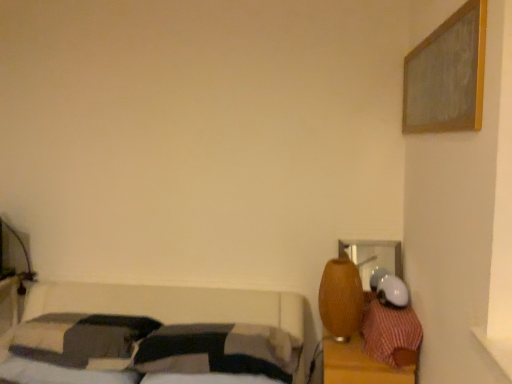
How much space does dark gray fabric pillow at lower left, the 1th pillow positioned from the left, occupy vertically?

6.39 inches.

Describe the element at coordinates (390, 333) in the screenshot. This screenshot has width=512, height=384. I see `red plaid pillow at right, marked as the 3th pillow in a left-to-right arrangement` at that location.

The width and height of the screenshot is (512, 384). What do you see at coordinates (359, 365) in the screenshot?
I see `wooden dresser at right` at bounding box center [359, 365].

You are a GUI agent. You are given a task and a screenshot of the screen. Output one action in this format:
    pyautogui.click(x=<x>, y=<y>)
    Task: Click on the braided wood table lamp at right
    This screenshot has height=384, width=512.
    Given the screenshot: What is the action you would take?
    pyautogui.click(x=341, y=299)

From the image's perspective, is soft cotton pillow at center, marked as the 2th pillow in a left-to-right arrangement, over braided wood table lamp at right?

Actually, soft cotton pillow at center, marked as the 2th pillow in a left-to-right arrangement, appears below braided wood table lamp at right in the image.

Looking at the image, does soft cotton pillow at center, marked as the 2th pillow in a left-to-right arrangement, seem bigger or smaller compared to braided wood table lamp at right?

Clearly, soft cotton pillow at center, marked as the 2th pillow in a left-to-right arrangement, is larger in size than braided wood table lamp at right.

Identify the location of the 3rd pillow located beneath the braided wood table lamp at right (from a real-world perspective). (220, 351).

From a real-world perspective, is braided wood table lamp at right positioned over red plaid pillow at right, marked as the 3th pillow in a left-to-right arrangement, based on gravity?

Yes.

Is point (352, 312) positioned after point (383, 361)?

That is True.

Is the surface of braided wood table lamp at right in direct contact with red plaid pillow at right, marked as the 3th pillow in a left-to-right arrangement?

No, braided wood table lamp at right is not touching red plaid pillow at right, marked as the 3th pillow in a left-to-right arrangement.

Considering the sizes of soft cotton pillow at center, positioned as the second pillow in right-to-left order, and wooden dresser at right in the image, is soft cotton pillow at center, positioned as the second pillow in right-to-left order, bigger or smaller than wooden dresser at right?

soft cotton pillow at center, positioned as the second pillow in right-to-left order, is smaller than wooden dresser at right.

Does soft cotton pillow at center, marked as the 2th pillow in a left-to-right arrangement, touch wooden dresser at right?

No, soft cotton pillow at center, marked as the 2th pillow in a left-to-right arrangement, is not with wooden dresser at right.

Is soft cotton pillow at center, marked as the 2th pillow in a left-to-right arrangement, further to camera compared to wooden dresser at right?

No, soft cotton pillow at center, marked as the 2th pillow in a left-to-right arrangement, is closer to the viewer.

Considering the sizes of objects soft cotton pillow at center, positioned as the second pillow in right-to-left order, and red plaid pillow at right, marked as the 3th pillow in a left-to-right arrangement, in the image provided, who is shorter, soft cotton pillow at center, positioned as the second pillow in right-to-left order, or red plaid pillow at right, marked as the 3th pillow in a left-to-right arrangement,?

soft cotton pillow at center, positioned as the second pillow in right-to-left order.

From a real-world perspective, is soft cotton pillow at center, marked as the 2th pillow in a left-to-right arrangement, physically above red plaid pillow at right, marked as the 3th pillow in a left-to-right arrangement?

No, from a real-world perspective, soft cotton pillow at center, marked as the 2th pillow in a left-to-right arrangement, is not over red plaid pillow at right, marked as the 3th pillow in a left-to-right arrangement

Where is `pillow located in front of the soft cotton pillow at center, positioned as the second pillow in right-to-left order`? Image resolution: width=512 pixels, height=384 pixels. pillow located in front of the soft cotton pillow at center, positioned as the second pillow in right-to-left order is located at coordinates (390, 333).

Could you measure the distance between braided wood table lamp at right and dark gray fabric pillow at lower left, placed as the third pillow when sorted from right to left?

braided wood table lamp at right and dark gray fabric pillow at lower left, placed as the third pillow when sorted from right to left, are 1.10 meters apart from each other.

From their relative heights in the image, would you say braided wood table lamp at right is taller or shorter than dark gray fabric pillow at lower left, the 1th pillow positioned from the left?

braided wood table lamp at right is taller than dark gray fabric pillow at lower left, the 1th pillow positioned from the left.

Is braided wood table lamp at right thinner than dark gray fabric pillow at lower left, the 1th pillow positioned from the left?

Yes, braided wood table lamp at right is thinner than dark gray fabric pillow at lower left, the 1th pillow positioned from the left.

Could you tell me if braided wood table lamp at right is turned towards dark gray fabric pillow at lower left, the 1th pillow positioned from the left?

No, braided wood table lamp at right is not oriented towards dark gray fabric pillow at lower left, the 1th pillow positioned from the left.

Which object is closer to the camera, wooden dresser at right or dark gray fabric pillow at lower left, the 1th pillow positioned from the left?

Positioned in front is wooden dresser at right.

Considering the relative sizes of wooden dresser at right and dark gray fabric pillow at lower left, the 1th pillow positioned from the left, in the image provided, is wooden dresser at right taller than dark gray fabric pillow at lower left, the 1th pillow positioned from the left,?

Yes.

Based on their positions, is wooden dresser at right located to the left or right of dark gray fabric pillow at lower left, placed as the third pillow when sorted from right to left?

In the image, wooden dresser at right appears on the right side of dark gray fabric pillow at lower left, placed as the third pillow when sorted from right to left.

What's the angular difference between wooden dresser at right and dark gray fabric pillow at lower left, placed as the third pillow when sorted from right to left,'s facing directions?

They differ by 0.000668 degrees in their facing directions.

Would you say dark gray fabric pillow at lower left, the 1th pillow positioned from the left, is outside braided wood table lamp at right?

Yes.

Considering the relative positions of dark gray fabric pillow at lower left, the 1th pillow positioned from the left, and braided wood table lamp at right in the image provided, is dark gray fabric pillow at lower left, the 1th pillow positioned from the left, to the right of braided wood table lamp at right from the viewer's perspective?

In fact, dark gray fabric pillow at lower left, the 1th pillow positioned from the left, is to the left of braided wood table lamp at right.

Which of these two, dark gray fabric pillow at lower left, the 1th pillow positioned from the left, or braided wood table lamp at right, is bigger?

With larger size is dark gray fabric pillow at lower left, the 1th pillow positioned from the left.

Is dark gray fabric pillow at lower left, the 1th pillow positioned from the left, far away from braided wood table lamp at right?

Indeed, dark gray fabric pillow at lower left, the 1th pillow positioned from the left, is not near braided wood table lamp at right.

The image size is (512, 384). I want to click on table lamp above the soft cotton pillow at center, marked as the 2th pillow in a left-to-right arrangement (from the image's perspective), so click(341, 299).

At what (x,y) coordinates should I click in order to perform the action: click on pillow on the right of braided wood table lamp at right. Please return your answer as a coordinate pair (x, y). The image size is (512, 384). Looking at the image, I should click on (390, 333).

From the image, which object appears to be farther from dark gray fabric pillow at lower left, the 1th pillow positioned from the left, red plaid pillow at right, which is the first pillow from right to left, or soft cotton pillow at center, positioned as the second pillow in right-to-left order?

red plaid pillow at right, which is the first pillow from right to left.

When comparing their distances from soft cotton pillow at center, positioned as the second pillow in right-to-left order, does red plaid pillow at right, marked as the 3th pillow in a left-to-right arrangement, or dark gray fabric pillow at lower left, placed as the third pillow when sorted from right to left, seem closer?

dark gray fabric pillow at lower left, placed as the third pillow when sorted from right to left, lies closer to soft cotton pillow at center, positioned as the second pillow in right-to-left order, than the other object.

Which object lies nearer to the anchor point braided wood table lamp at right, soft cotton pillow at center, positioned as the second pillow in right-to-left order, or wooden dresser at right?

Based on the image, wooden dresser at right appears to be nearer to braided wood table lamp at right.

Based on the photo, which object lies nearer to the anchor point wooden dresser at right, soft cotton pillow at center, marked as the 2th pillow in a left-to-right arrangement, or dark gray fabric pillow at lower left, placed as the third pillow when sorted from right to left?

The object closer to wooden dresser at right is soft cotton pillow at center, marked as the 2th pillow in a left-to-right arrangement.

Considering their positions, is red plaid pillow at right, marked as the 3th pillow in a left-to-right arrangement, positioned further to wooden dresser at right than braided wood table lamp at right?

braided wood table lamp at right is further to wooden dresser at right.

Which object lies further to the anchor point dark gray fabric pillow at lower left, the 1th pillow positioned from the left, braided wood table lamp at right or red plaid pillow at right, which is the first pillow from right to left?

Among the two, red plaid pillow at right, which is the first pillow from right to left, is located further to dark gray fabric pillow at lower left, the 1th pillow positioned from the left.

Which object lies further to the anchor point red plaid pillow at right, marked as the 3th pillow in a left-to-right arrangement, wooden dresser at right or dark gray fabric pillow at lower left, placed as the third pillow when sorted from right to left?

dark gray fabric pillow at lower left, placed as the third pillow when sorted from right to left, is further to red plaid pillow at right, marked as the 3th pillow in a left-to-right arrangement.

Looking at the image, which one is located further to braided wood table lamp at right, soft cotton pillow at center, marked as the 2th pillow in a left-to-right arrangement, or dark gray fabric pillow at lower left, the 1th pillow positioned from the left?

The object further to braided wood table lamp at right is dark gray fabric pillow at lower left, the 1th pillow positioned from the left.

What are the coordinates of `dresser situated between dark gray fabric pillow at lower left, placed as the third pillow when sorted from right to left, and red plaid pillow at right, which is the first pillow from right to left, from left to right` in the screenshot? It's located at click(359, 365).

This screenshot has height=384, width=512. Find the location of `pillow situated between dark gray fabric pillow at lower left, placed as the third pillow when sorted from right to left, and red plaid pillow at right, marked as the 3th pillow in a left-to-right arrangement, from left to right`. pillow situated between dark gray fabric pillow at lower left, placed as the third pillow when sorted from right to left, and red plaid pillow at right, marked as the 3th pillow in a left-to-right arrangement, from left to right is located at coordinates (220, 351).

Locate an element on the screen. table lamp between soft cotton pillow at center, marked as the 2th pillow in a left-to-right arrangement, and wooden dresser at right, in the horizontal direction is located at coordinates (341, 299).

In order to click on pillow located between dark gray fabric pillow at lower left, placed as the third pillow when sorted from right to left, and wooden dresser at right in the left-right direction in this screenshot , I will do `click(220, 351)`.